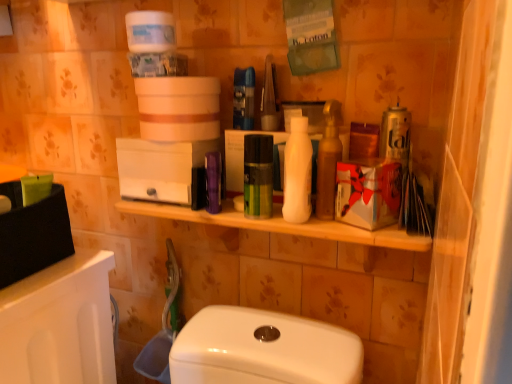
Question: In which direction should I rotate to look at white matte bottle at center, which is counted as the second toiletry, starting from the left?

Choices:
 (A) left
 (B) right

Answer: (B)

Question: Considering the relative positions of white matte bottle at center, which is the 1th toiletry from right to left, and green matte mouthwash at center in the image provided, is white matte bottle at center, which is the 1th toiletry from right to left, to the left of green matte mouthwash at center from the viewer's perspective?

Choices:
 (A) yes
 (B) no

Answer: (B)

Question: Is white matte bottle at center, which is the 1th toiletry from right to left, shorter than green matte mouthwash at center?

Choices:
 (A) yes
 (B) no

Answer: (B)

Question: Is white matte bottle at center, which is the 1th toiletry from right to left, not close to green matte mouthwash at center?

Choices:
 (A) yes
 (B) no

Answer: (B)

Question: Can you confirm if white matte bottle at center, which is the 1th toiletry from right to left, is thinner than green matte mouthwash at center?

Choices:
 (A) no
 (B) yes

Answer: (A)

Question: Would you say green matte mouthwash at center is part of white matte bottle at center, which is counted as the second toiletry, starting from the left,'s contents?

Choices:
 (A) no
 (B) yes

Answer: (A)

Question: Is the position of white matte bottle at center, which is counted as the second toiletry, starting from the left, less distant than that of green matte mouthwash at center?

Choices:
 (A) yes
 (B) no

Answer: (A)

Question: Are shiny brown bottle at center and purple plastic container at center, arranged as the first toiletry when viewed from the left, located far from each other?

Choices:
 (A) no
 (B) yes

Answer: (A)

Question: From a real-world perspective, is shiny brown bottle at center positioned under purple plastic container at center, the second toiletry from the right, based on gravity?

Choices:
 (A) no
 (B) yes

Answer: (A)

Question: Can you confirm if shiny brown bottle at center is shorter than purple plastic container at center, arranged as the first toiletry when viewed from the left?

Choices:
 (A) yes
 (B) no

Answer: (B)

Question: Does shiny brown bottle at center touch purple plastic container at center, the second toiletry from the right?

Choices:
 (A) no
 (B) yes

Answer: (A)

Question: Considering the relative sizes of shiny brown bottle at center and purple plastic container at center, the second toiletry from the right, in the image provided, is shiny brown bottle at center thinner than purple plastic container at center, the second toiletry from the right,?

Choices:
 (A) no
 (B) yes

Answer: (A)

Question: Is shiny brown bottle at center outside purple plastic container at center, the second toiletry from the right?

Choices:
 (A) no
 (B) yes

Answer: (B)

Question: From a real-world perspective, is purple plastic container at center, arranged as the first toiletry when viewed from the left, positioned under shiny brown bottle at center based on gravity?

Choices:
 (A) no
 (B) yes

Answer: (B)